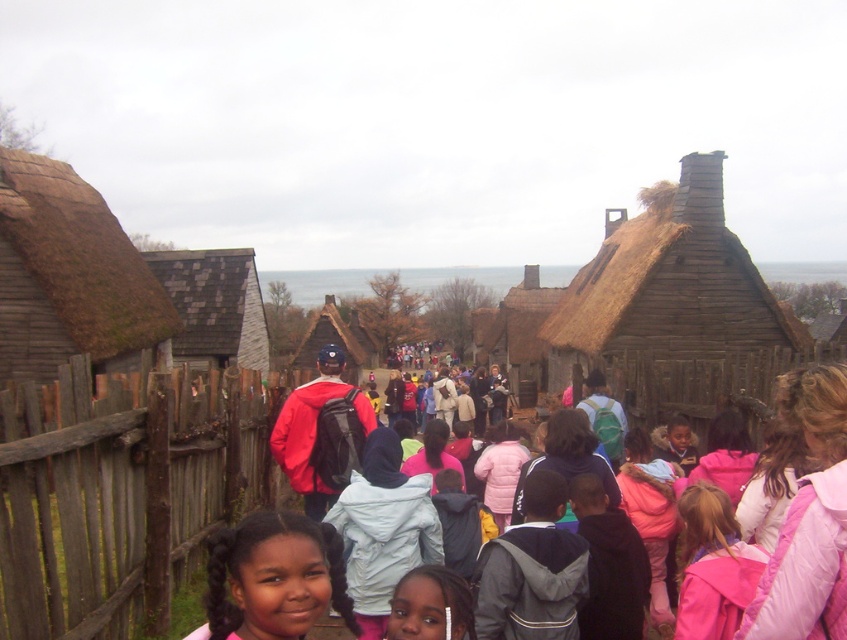
Is thatched wood hut at left below brown thatched roof hut at center?

Incorrect, thatched wood hut at left is not positioned below brown thatched roof hut at center.

Between thatched wood hut at left and brown thatched roof hut at center, which one is positioned higher?

thatched wood hut at left

Image resolution: width=847 pixels, height=640 pixels. Find the location of `thatched wood hut at left`. thatched wood hut at left is located at coordinates (68, 275).

Which of these two, pink fleece jacket at center or brown thatched roof hut at center, stands shorter?

Standing shorter between the two is pink fleece jacket at center.

The width and height of the screenshot is (847, 640). What do you see at coordinates (650, 516) in the screenshot?
I see `pink fleece jacket at center` at bounding box center [650, 516].

Identify the location of pink fleece jacket at center. Image resolution: width=847 pixels, height=640 pixels. (650, 516).

Can you confirm if brown wooden fence at lower left is shorter than gray shingled hut at center?

Yes, brown wooden fence at lower left is shorter than gray shingled hut at center.

Can you confirm if brown wooden fence at lower left is positioned to the right of gray shingled hut at center?

Yes, brown wooden fence at lower left is to the right of gray shingled hut at center.

Is point (47, 426) positioned behind point (223, 252)?

No, (47, 426) is in front of (223, 252).

Image resolution: width=847 pixels, height=640 pixels. In order to click on brown wooden fence at lower left in this screenshot , I will do `click(122, 486)`.